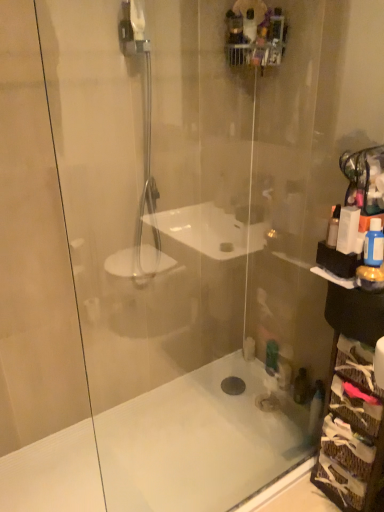
Describe the element at coordinates (192, 443) in the screenshot. Image resolution: width=384 pixels, height=512 pixels. I see `white matte bathtub at lower center` at that location.

Describe the element at coordinates (348, 229) in the screenshot. I see `white plastic box at right, the 2th toiletry when ordered from left to right` at that location.

The image size is (384, 512). What do you see at coordinates (351, 430) in the screenshot? I see `woven basket at right` at bounding box center [351, 430].

In order to face blue glossy bottle at right, arranged as the 1th toiletry when viewed from the right, should I rotate leftwards or rightwards?

You should rotate right by 23.055 degrees.

The width and height of the screenshot is (384, 512). Identify the location of white matte bathtub at lower center. (192, 443).

Is white plastic box at right, which is the 2th toiletry from right to left, positioned far away from woven basket at right?

white plastic box at right, which is the 2th toiletry from right to left, is actually quite close to woven basket at right.

Is point (345, 224) positioned after point (361, 354)?

That is False.

Is white plastic bottle at right, the first toiletry when ordered from left to right, smaller than white plastic box at right, the 2th toiletry when ordered from left to right?

Yes, white plastic bottle at right, the first toiletry when ordered from left to right, is smaller than white plastic box at right, the 2th toiletry when ordered from left to right.

From a real-world perspective, which object stands above the other?

In real-world perspective, white plastic box at right, which is the 2th toiletry from right to left, is above.

From the image's perspective, which one is positioned lower, white plastic bottle at right, the 3th toiletry in the right-to-left sequence, or white plastic box at right, which is the 2th toiletry from right to left?

white plastic bottle at right, the 3th toiletry in the right-to-left sequence, is shown below in the image.

Is white plastic bottle at right, the 3th toiletry in the right-to-left sequence, in contact with white plastic box at right, which is the 2th toiletry from right to left?

Yes, white plastic bottle at right, the 3th toiletry in the right-to-left sequence, is touching white plastic box at right, which is the 2th toiletry from right to left.

Are white matte bathtub at lower center and woven basket at right far apart?

No, there isn't a large distance between white matte bathtub at lower center and woven basket at right.

Is white matte bathtub at lower center oriented towards woven basket at right?

No, white matte bathtub at lower center is not turned towards woven basket at right.

From a real-world perspective, which is physically above, woven basket at right or white plastic box at right, the 2th toiletry when ordered from left to right?

In real-world perspective, white plastic box at right, the 2th toiletry when ordered from left to right, is above.

Between point (343, 398) and point (346, 251), which one is positioned behind?

The point (343, 398) is farther from the camera.

Between woven basket at right and white plastic box at right, the 2th toiletry when ordered from left to right, which one has less height?

Standing shorter between the two is white plastic box at right, the 2th toiletry when ordered from left to right.

Is point (334, 211) less distant than point (357, 371)?

That is True.

Considering the sizes of objects white plastic bottle at right, the 3th toiletry in the right-to-left sequence, and woven basket at right in the image provided, who is wider, white plastic bottle at right, the 3th toiletry in the right-to-left sequence, or woven basket at right?

woven basket at right is wider.

Is the depth of white plastic bottle at right, the first toiletry when ordered from left to right, less than that of woven basket at right?

No.

Considering the relative sizes of white plastic bottle at right, the 3th toiletry in the right-to-left sequence, and woven basket at right in the image provided, is white plastic bottle at right, the 3th toiletry in the right-to-left sequence, smaller than woven basket at right?

Yes, white plastic bottle at right, the 3th toiletry in the right-to-left sequence, is smaller than woven basket at right.

Is the depth of blue glossy bottle at right, arranged as the 1th toiletry when viewed from the right, less than that of white matte bathtub at lower center?

Yes, blue glossy bottle at right, arranged as the 1th toiletry when viewed from the right, is in front of white matte bathtub at lower center.

Can you tell me how much blue glossy bottle at right, the third toiletry in the left-to-right sequence, and white matte bathtub at lower center differ in facing direction?

→ There is a 89.5-degree angle between the facing directions of blue glossy bottle at right, the third toiletry in the left-to-right sequence, and white matte bathtub at lower center.

From the image's perspective, which is above, blue glossy bottle at right, the third toiletry in the left-to-right sequence, or white matte bathtub at lower center?

From the image's view, blue glossy bottle at right, the third toiletry in the left-to-right sequence, is above.

Is blue glossy bottle at right, the third toiletry in the left-to-right sequence, oriented towards white matte bathtub at lower center?

No, blue glossy bottle at right, the third toiletry in the left-to-right sequence, is not facing towards white matte bathtub at lower center.

From the image's perspective, between white plastic box at right, which is the 2th toiletry from right to left, and white matte bathtub at lower center, who is located below?

white matte bathtub at lower center.

Considering the relative sizes of white plastic box at right, the 2th toiletry when ordered from left to right, and white matte bathtub at lower center in the image provided, is white plastic box at right, the 2th toiletry when ordered from left to right, smaller than white matte bathtub at lower center?

Yes.

How distant is white plastic box at right, which is the 2th toiletry from right to left, from white matte bathtub at lower center?

A distance of 1.17 meters exists between white plastic box at right, which is the 2th toiletry from right to left, and white matte bathtub at lower center.

Are white plastic box at right, the 2th toiletry when ordered from left to right, and white matte bathtub at lower center located far from each other?

white plastic box at right, the 2th toiletry when ordered from left to right, is far away from white matte bathtub at lower center.

Identify the location of glass box that is under the white plastic box at right, the 2th toiletry when ordered from left to right (from a real-world perspective). (351, 430).

The height and width of the screenshot is (512, 384). There is a white plastic bottle at right, the 3th toiletry in the right-to-left sequence. What are the coordinates of `the 2nd toiletry above it (from a real-world perspective)` in the screenshot? It's located at (348, 229).

Looking at the image, which one is located further to blue glossy bottle at right, the third toiletry in the left-to-right sequence, white plastic box at right, the 2th toiletry when ordered from left to right, or white matte bathtub at lower center?

white matte bathtub at lower center.

Based on the photo, looking at the image, which one is located further to white matte bathtub at lower center, white plastic bottle at right, the first toiletry when ordered from left to right, or woven basket at right?

The object further to white matte bathtub at lower center is white plastic bottle at right, the first toiletry when ordered from left to right.

Which object lies further to the anchor point white matte bathtub at lower center, woven basket at right or blue glossy bottle at right, the third toiletry in the left-to-right sequence?

Based on the image, blue glossy bottle at right, the third toiletry in the left-to-right sequence, appears to be further to white matte bathtub at lower center.

From the image, which object appears to be nearer to white plastic box at right, which is the 2th toiletry from right to left, white plastic bottle at right, the 3th toiletry in the right-to-left sequence, or woven basket at right?

The object closer to white plastic box at right, which is the 2th toiletry from right to left, is white plastic bottle at right, the 3th toiletry in the right-to-left sequence.

Which object lies nearer to the anchor point white plastic bottle at right, the 3th toiletry in the right-to-left sequence, blue glossy bottle at right, arranged as the 1th toiletry when viewed from the right, or woven basket at right?

blue glossy bottle at right, arranged as the 1th toiletry when viewed from the right, lies closer to white plastic bottle at right, the 3th toiletry in the right-to-left sequence, than the other object.

When comparing their distances from white plastic bottle at right, the 3th toiletry in the right-to-left sequence, does blue glossy bottle at right, arranged as the 1th toiletry when viewed from the right, or white matte bathtub at lower center seem closer?

The object closer to white plastic bottle at right, the 3th toiletry in the right-to-left sequence, is blue glossy bottle at right, arranged as the 1th toiletry when viewed from the right.

Based on their spatial positions, is blue glossy bottle at right, arranged as the 1th toiletry when viewed from the right, or woven basket at right closer to white plastic box at right, the 2th toiletry when ordered from left to right?

The object closer to white plastic box at right, the 2th toiletry when ordered from left to right, is blue glossy bottle at right, arranged as the 1th toiletry when viewed from the right.

Considering their positions, is white plastic bottle at right, the 3th toiletry in the right-to-left sequence, positioned further to woven basket at right than blue glossy bottle at right, arranged as the 1th toiletry when viewed from the right?

Based on the image, white plastic bottle at right, the 3th toiletry in the right-to-left sequence, appears to be further to woven basket at right.

Where is `glass box between white plastic box at right, which is the 2th toiletry from right to left, and white matte bathtub at lower center in the up-down direction`? This screenshot has height=512, width=384. glass box between white plastic box at right, which is the 2th toiletry from right to left, and white matte bathtub at lower center in the up-down direction is located at coordinates (351, 430).

This screenshot has height=512, width=384. Find the location of `toiletry that lies between white plastic bottle at right, the first toiletry when ordered from left to right, and white matte bathtub at lower center from top to bottom`. toiletry that lies between white plastic bottle at right, the first toiletry when ordered from left to right, and white matte bathtub at lower center from top to bottom is located at coordinates (374, 244).

In order to click on glass box between blue glossy bottle at right, arranged as the 1th toiletry when viewed from the right, and white matte bathtub at lower center vertically in this screenshot , I will do 351,430.

The width and height of the screenshot is (384, 512). I want to click on toiletry that lies between white plastic bottle at right, the first toiletry when ordered from left to right, and woven basket at right from top to bottom, so click(x=374, y=244).